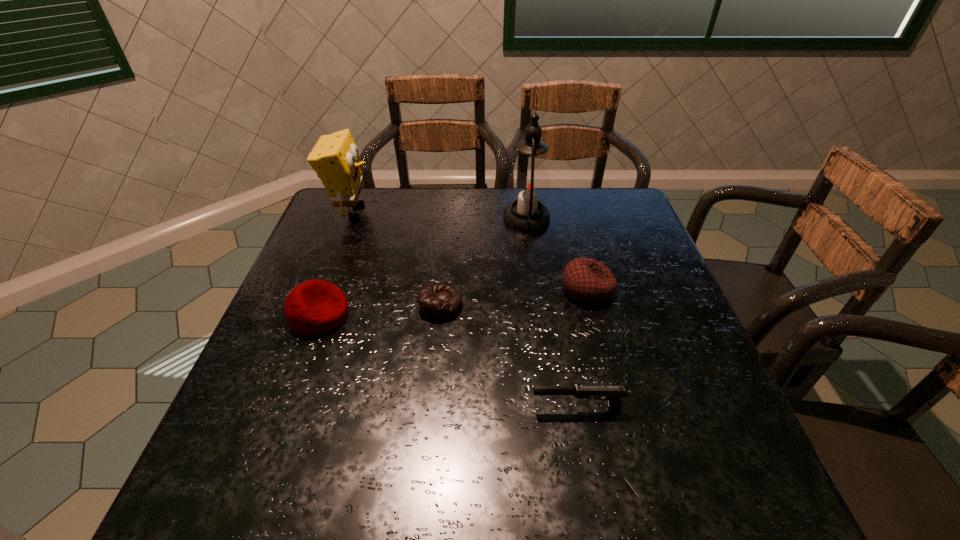
The image size is (960, 540). In order to click on free spot that satisfies the following two spatial constraints: 1. on the face of the rightmost beanbag; 2. on the left side of the sponge in this screenshot , I will do `click(323, 289)`.

Find the location of a particular element. The width and height of the screenshot is (960, 540). vacant space that satisfies the following two spatial constraints: 1. on the front side of the rightmost beanbag; 2. at the muzzle end of the nearest object is located at coordinates (618, 408).

Identify the location of free location that satisfies the following two spatial constraints: 1. on the back side of the rightmost beanbag; 2. on the right side of the second beanbag from left to right. (442, 289).

What are the coordinates of `free space that satisfies the following two spatial constraints: 1. on the front side of the tallest object; 2. on the seat area of the leftmost beanbag` in the screenshot? It's located at (540, 315).